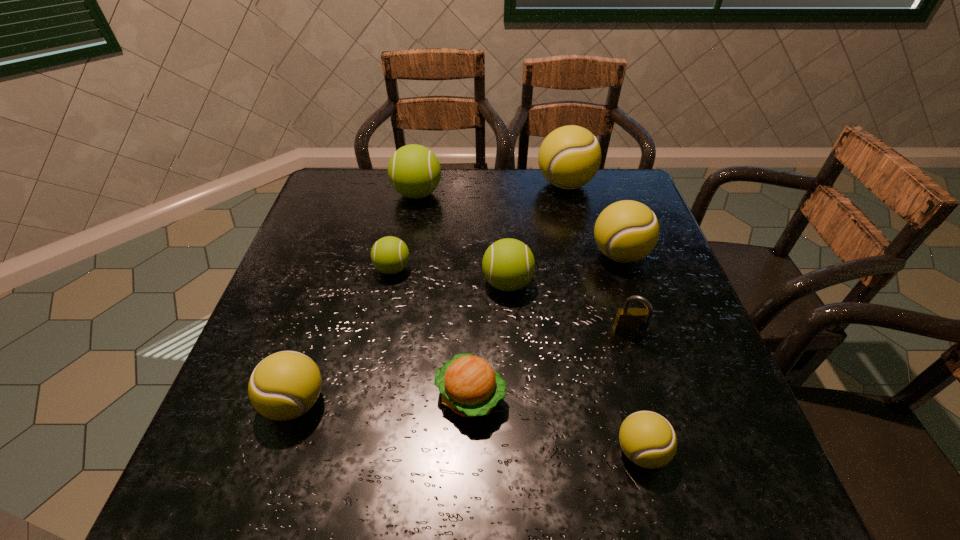
Find the location of a particular element. The width and height of the screenshot is (960, 540). vacant area located 0.240m on the back of the smallest yellow tennis ball is located at coordinates coord(607,322).

Find the location of a particular element. object positioned at the near edge is located at coordinates (648, 440).

The image size is (960, 540). What are the coordinates of `object that is at the left edge` in the screenshot? It's located at (285, 385).

At what (x,y) coordinates should I click in order to perform the action: click on padlock that is at the right edge. Please return your answer as a coordinate pair (x, y). This screenshot has width=960, height=540. Looking at the image, I should click on (628, 320).

Find the location of a particular element. object that is at the far right corner is located at coordinates (569, 157).

I want to click on object that is at the near right corner, so click(x=648, y=440).

Where is `vacant point at the far edge`? vacant point at the far edge is located at coordinates (478, 168).

Identify the location of free space at the near edge of the desktop. This screenshot has width=960, height=540. click(360, 448).

Find the location of a particular element. free space at the left edge is located at coordinates [323, 232].

At what (x,y) coordinates should I click in order to perform the action: click on vacant space at the right edge of the desktop. Please return your answer as a coordinate pair (x, y). The height and width of the screenshot is (540, 960). Looking at the image, I should click on (617, 289).